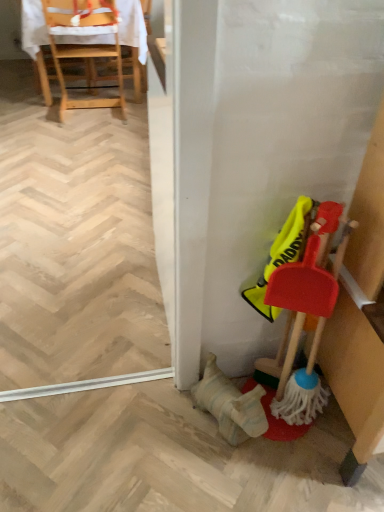
Image resolution: width=384 pixels, height=512 pixels. Find the location of `vacant area situated to the left side of wooden chair at upper left`. vacant area situated to the left side of wooden chair at upper left is located at coordinates (22, 111).